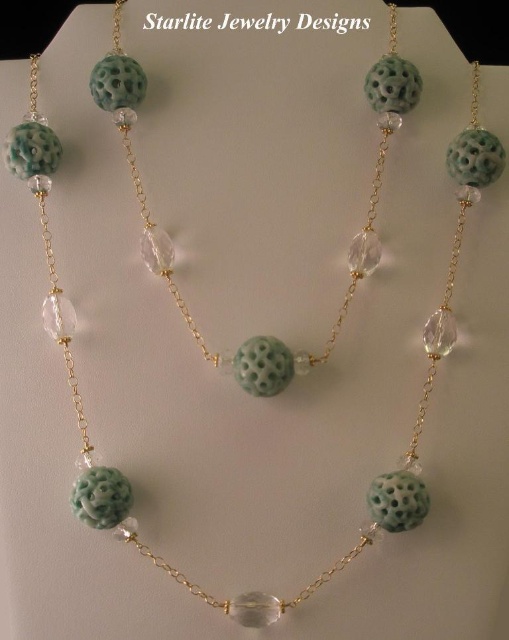
You are a jeweler who needs to adjust the necklace so that the matte green stone at center is closer to the viewer by 1.5 feet. How much shorter should the chain be?

To move the matte green stone at center closer by 1.5 feet, the chain should be shortened by 1.5 feet so that the matte green stone at center is now 2.58 feet away from the viewer.

You are an appraiser examining the necklace. You notice two points on the necklace at coordinates point (379, 102) and point (383, 524). Which point is closer to you?

Point (379, 102) is further to the viewer than point (383, 524), so point (379, 102) is closer to you.

Looking at the necklace on the mannequin bust, which of the two stones at the center is taller, the matte green stone at center or the green carved stone at center?

The matte green stone at center is taller than the green carved stone at center.